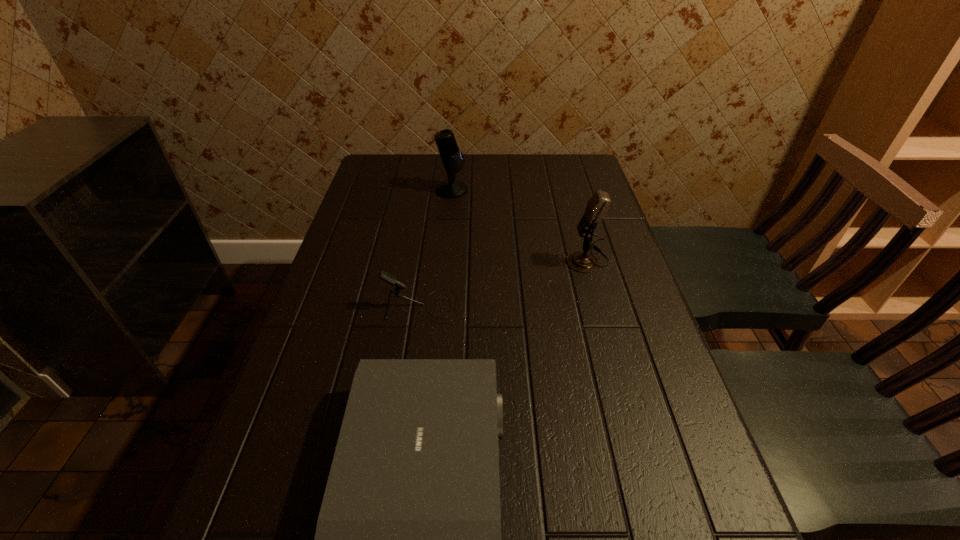
Where is `the second farthest object`? This screenshot has width=960, height=540. the second farthest object is located at coordinates (598, 205).

I want to click on the rightmost object, so click(x=598, y=205).

Find the location of a particular element. The height and width of the screenshot is (540, 960). the farthest object is located at coordinates (452, 158).

At what (x,y) coordinates should I click in order to perform the action: click on the nearest microphone. Please return your answer as a coordinate pair (x, y). This screenshot has width=960, height=540. Looking at the image, I should click on (389, 278).

What are the coordinates of `the second nearest object` in the screenshot? It's located at (389, 278).

You are a GUI agent. You are given a task and a screenshot of the screen. Output one action in this format:
    pyautogui.click(x=<x>, y=<y>)
    Task: Click on the vacant space located on the front-facing side of the rightmost object
    This screenshot has height=540, width=960.
    Given the screenshot: What is the action you would take?
    pyautogui.click(x=475, y=259)

Locate an element on the screen. vacant space located 0.100m on the front-facing side of the rightmost object is located at coordinates (529, 259).

Image resolution: width=960 pixels, height=540 pixels. Find the location of `vacant region located 0.120m on the front-facing side of the rightmost object`. vacant region located 0.120m on the front-facing side of the rightmost object is located at coordinates (521, 259).

Where is `vacant space located on the stand of the farthest object`? This screenshot has height=540, width=960. vacant space located on the stand of the farthest object is located at coordinates (564, 190).

This screenshot has width=960, height=540. Identify the location of vacant space positioned on the stand of the nearest microphone. (491, 306).